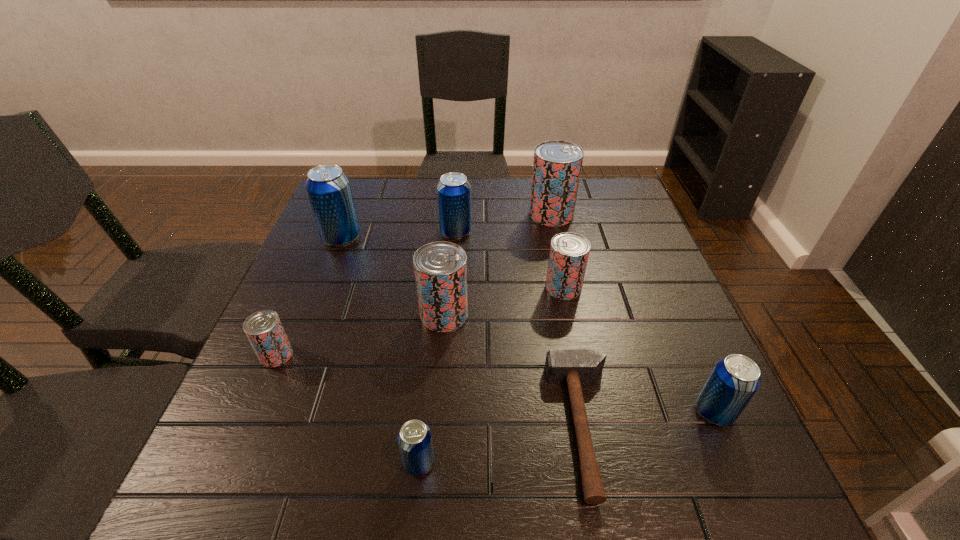
I want to click on the nearest beer can, so click(414, 439).

Find the location of a particular element. The height and width of the screenshot is (540, 960). the shortest object is located at coordinates (573, 366).

Where is `vacant region located on the left of the farthest red beer can`? The image size is (960, 540). vacant region located on the left of the farthest red beer can is located at coordinates (491, 214).

Find the location of `blank space located 0.240m on the front of the leftmost blue beer can`. blank space located 0.240m on the front of the leftmost blue beer can is located at coordinates (311, 318).

Find the location of a particular element. free spot located on the right of the second biggest blue beer can is located at coordinates (573, 232).

You are a GUI agent. You are given a task and a screenshot of the screen. Output one action in this format:
    pyautogui.click(x=<x>, y=<y>)
    Task: Click on the free point located 0.380m on the back of the third smallest red beer can
    This screenshot has width=960, height=540.
    Given the screenshot: What is the action you would take?
    pyautogui.click(x=453, y=207)

Identify the location of vacant area located on the back of the second smallest red beer can. (550, 222).

Image resolution: width=960 pixels, height=540 pixels. Find the location of `free space located 0.220m on the left of the rightmost beer can`. free space located 0.220m on the left of the rightmost beer can is located at coordinates (575, 411).

Image resolution: width=960 pixels, height=540 pixels. Identify the location of free spot located on the right of the leftmost red beer can. (469, 355).

Find the location of `free space located on the left of the nearest beer can`. free space located on the left of the nearest beer can is located at coordinates (307, 462).